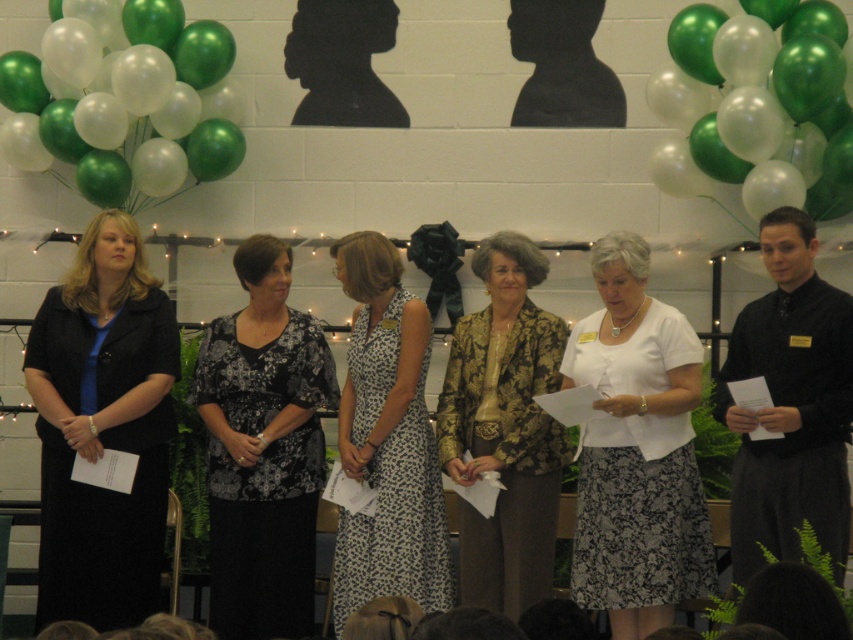
Question: Among these points, which one is farthest from the camera?

Choices:
 (A) (824, 60)
 (B) (144, 83)
 (C) (57, 513)
 (D) (741, 500)

Answer: (B)

Question: Which point is closer to the camera?

Choices:
 (A) matte black dress at left
 (B) green metallic balloons at upper right
 (C) white matte dress at center

Answer: (C)

Question: Does green metallic balloons at upper right appear on the right side of gold brocade jacket at center?

Choices:
 (A) yes
 (B) no

Answer: (A)

Question: Can you confirm if green metallic balloons at upper left is bigger than gold brocade jacket at center?

Choices:
 (A) yes
 (B) no

Answer: (A)

Question: Which object is farther from the camera taking this photo?

Choices:
 (A) black printed blouse at center
 (B) white dotted dress at center
 (C) matte black dress at left

Answer: (A)

Question: Does black smooth shirt at right appear under gold brocade jacket at center?

Choices:
 (A) no
 (B) yes

Answer: (A)